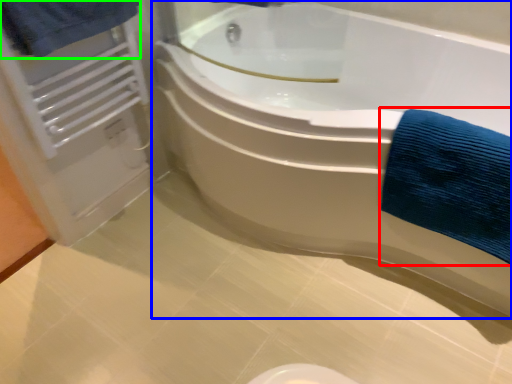
Question: Which object is positioned farthest from bath towel (highlighted by a red box)? Select from bathtub (highlighted by a blue box) and bath towel (highlighted by a green box).

Choices:
 (A) bathtub
 (B) bath towel

Answer: (B)